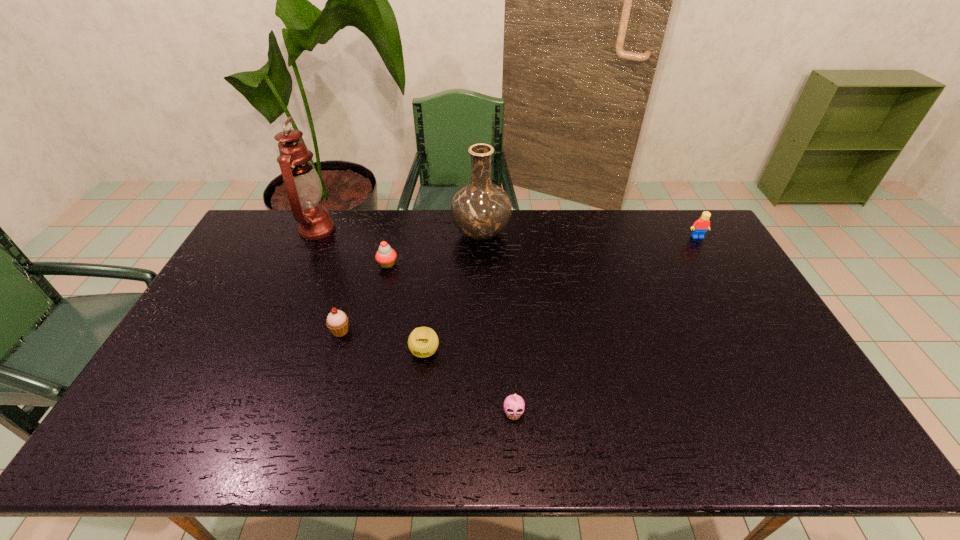
I want to click on vase located in the far edge section of the desktop, so click(x=481, y=210).

You are a GUI agent. You are given a task and a screenshot of the screen. Output one action in this format:
    pyautogui.click(x=<x>, y=<y>)
    Task: Click on the Lego present at the far edge
    The width and height of the screenshot is (960, 540).
    Given the screenshot: What is the action you would take?
    [x=700, y=226]

Find the location of `object that is at the near edge`. object that is at the near edge is located at coordinates (515, 404).

Where is `object that is at the right edge`? The width and height of the screenshot is (960, 540). object that is at the right edge is located at coordinates 700,226.

At what (x,y) coordinates should I click in order to perform the action: click on object that is at the far right corner. Please return your answer as a coordinate pair (x, y). The width and height of the screenshot is (960, 540). Looking at the image, I should click on (700, 226).

Locate an element on the screen. This screenshot has height=540, width=960. vacant space at the far edge of the desktop is located at coordinates coord(563,210).

Find the location of a particular element. free spot at the near edge of the desktop is located at coordinates (470, 433).

In the image, there is a desktop. In order to click on vacant area at the left edge in this screenshot , I will do `click(198, 342)`.

Locate an element on the screen. Image resolution: width=960 pixels, height=540 pixels. vacant space at the right edge of the desktop is located at coordinates (702, 262).

Locate an element on the screen. The image size is (960, 540). blank region between the nearest object and the sixth shortest object is located at coordinates (497, 323).